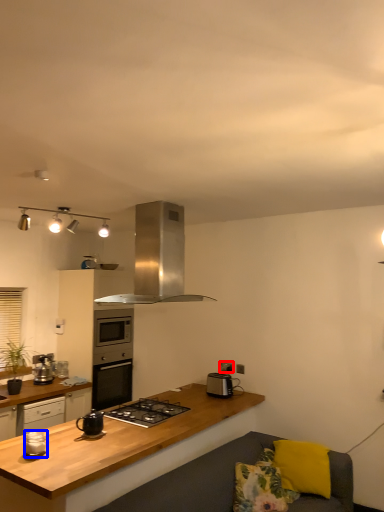
Question: Which object is further to the camera taking this photo, electric outlet (highlighted by a red box) or kitchen appliance (highlighted by a blue box)?

Choices:
 (A) electric outlet
 (B) kitchen appliance

Answer: (A)